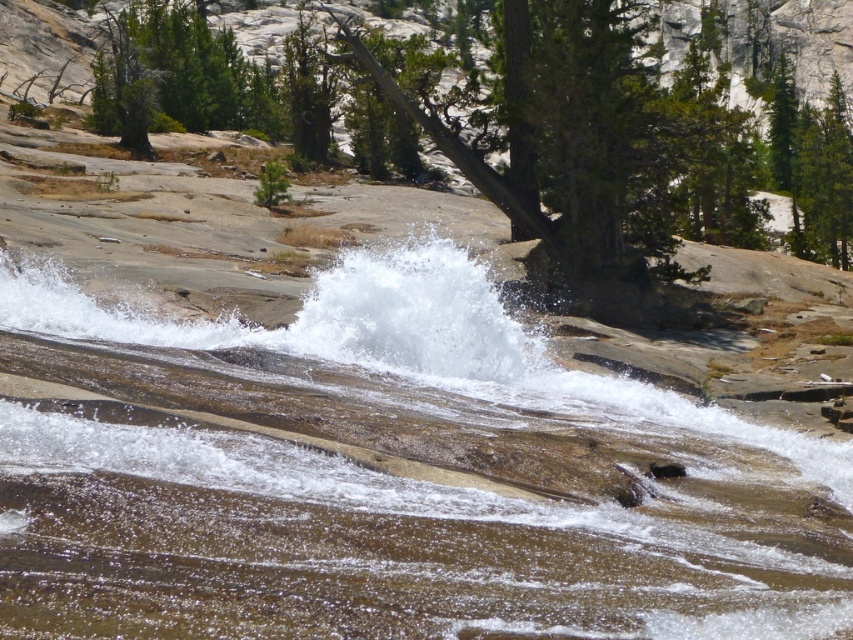
Looking at this image, which is below, white frothy water at center or green textured tree at center?

white frothy water at center

Based on the photo, is white frothy water at center to the left of green textured tree at center from the viewer's perspective?

Correct, you'll find white frothy water at center to the left of green textured tree at center.

This screenshot has width=853, height=640. What do you see at coordinates (392, 477) in the screenshot? I see `white frothy water at center` at bounding box center [392, 477].

Locate an element on the screen. Image resolution: width=853 pixels, height=640 pixels. white frothy water at center is located at coordinates (392, 477).